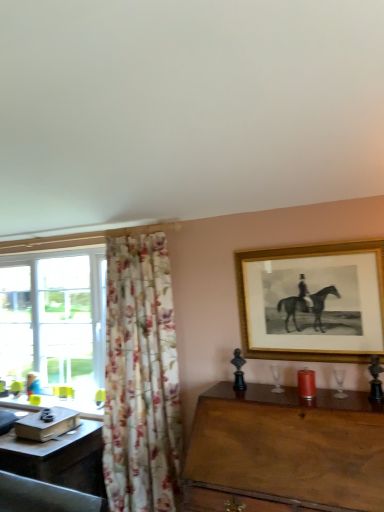
Question: Are blue fabric person at lower left and floral fabric curtain at left beside each other?

Choices:
 (A) yes
 (B) no

Answer: (B)

Question: From the image's perspective, does blue fabric person at lower left appear lower than floral fabric curtain at left?

Choices:
 (A) yes
 (B) no

Answer: (A)

Question: From the image's perspective, is blue fabric person at lower left above floral fabric curtain at left?

Choices:
 (A) no
 (B) yes

Answer: (A)

Question: Is blue fabric person at lower left positioned before floral fabric curtain at left?

Choices:
 (A) yes
 (B) no

Answer: (B)

Question: Considering the relative sizes of blue fabric person at lower left and floral fabric curtain at left in the image provided, is blue fabric person at lower left bigger than floral fabric curtain at left?

Choices:
 (A) yes
 (B) no

Answer: (B)

Question: Looking at the image, does wooden desk at lower left seem bigger or smaller compared to wooden table at right?

Choices:
 (A) big
 (B) small

Answer: (B)

Question: From their relative heights in the image, would you say wooden desk at lower left is taller or shorter than wooden table at right?

Choices:
 (A) tall
 (B) short

Answer: (B)

Question: Is point (100, 441) closer or farther from the camera than point (377, 497)?

Choices:
 (A) farther
 (B) closer

Answer: (A)

Question: From the image's perspective, relative to wooden table at right, is wooden desk at lower left above or below?

Choices:
 (A) below
 (B) above

Answer: (A)

Question: Looking at their shapes, would you say wooden desk at lower left is wider or thinner than floral fabric curtain at left?

Choices:
 (A) wide
 (B) thin

Answer: (A)

Question: From the image's perspective, is wooden desk at lower left positioned above or below floral fabric curtain at left?

Choices:
 (A) below
 (B) above

Answer: (A)

Question: Is point (11, 459) closer or farther from the camera than point (162, 444)?

Choices:
 (A) closer
 (B) farther

Answer: (A)

Question: Considering the positions of wooden desk at lower left and floral fabric curtain at left in the image, is wooden desk at lower left taller or shorter than floral fabric curtain at left?

Choices:
 (A) tall
 (B) short

Answer: (B)

Question: Is gold framed print at upper right wider or thinner than wooden table at right?

Choices:
 (A) thin
 (B) wide

Answer: (A)

Question: From the image's perspective, is gold framed print at upper right located above or below wooden table at right?

Choices:
 (A) above
 (B) below

Answer: (A)